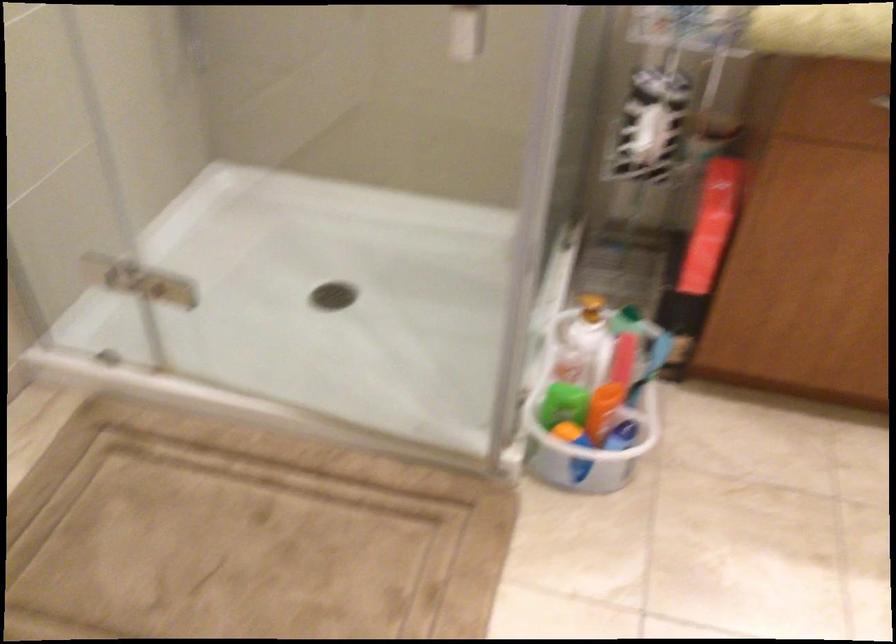
Locate an element on the screen. shower door handle is located at coordinates (140, 279).